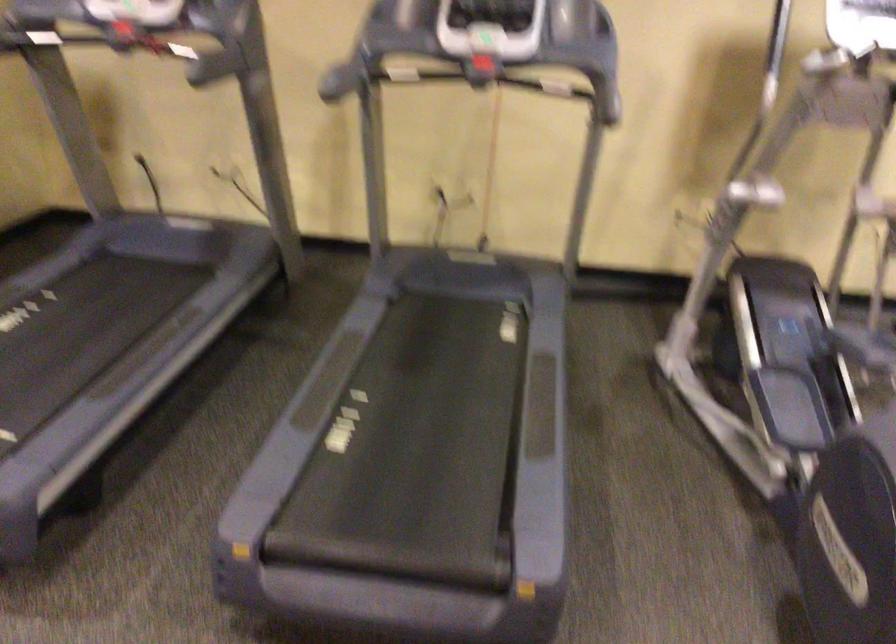
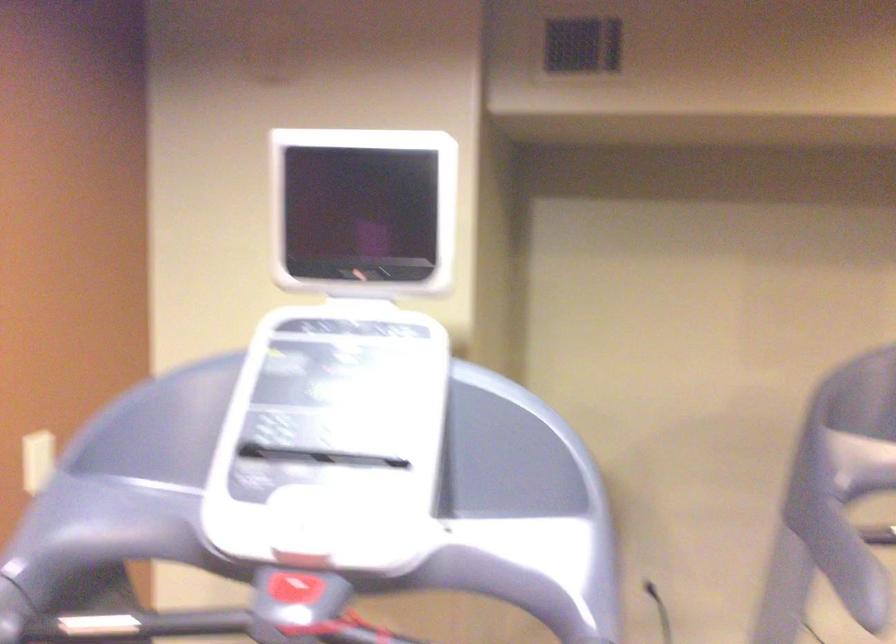
Which direction would the cameraman need to move to produce the second image?

The movement direction of the cameraman is left, forward.